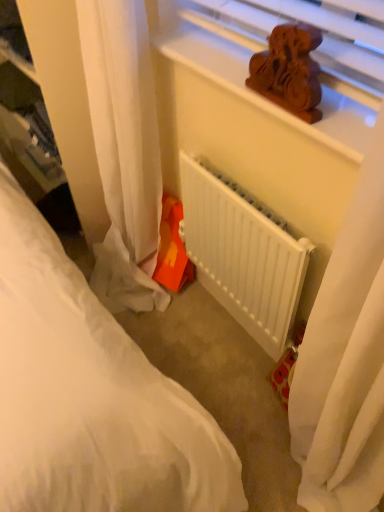
Find the location of a particular element. vacant space behind brown wooden statue at upper center is located at coordinates (226, 66).